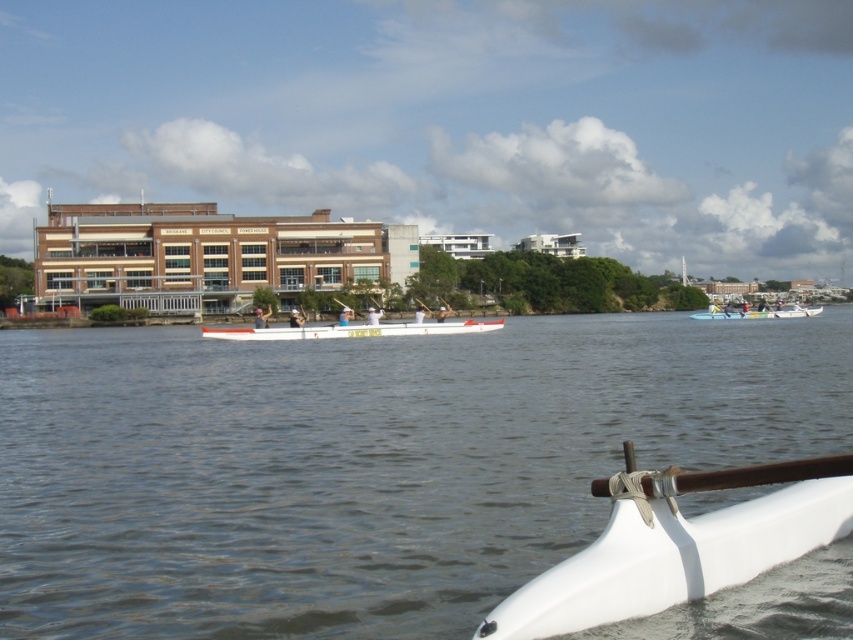
You are standing on the dock and want to board the white matte boat at lower right. Which direction should you look to see the white smooth water at center before boarding?

The white smooth water at center is further to the viewer than the white matte boat at lower right, so you should look towards the direction of the white smooth water at center before boarding to see it.

Based on the photo, you are standing on the dock and want to board the white matte boat at lower right. The white smooth water at center is in your path. Since the water is wider than the boat, will you need to walk around it to reach the boat?

The white smooth water at center is wider than the white matte boat at lower right, so you would need to walk around the water to reach the boat.

You are standing on the dock and want to reach the point marked at coordinates point (653, 496). If your maximum reach is 6 meters, can you touch it?

The point (653, 496) is 6.23 meters away from the viewer, which exceeds your maximum reach of 6 meters. Therefore, you cannot touch it.